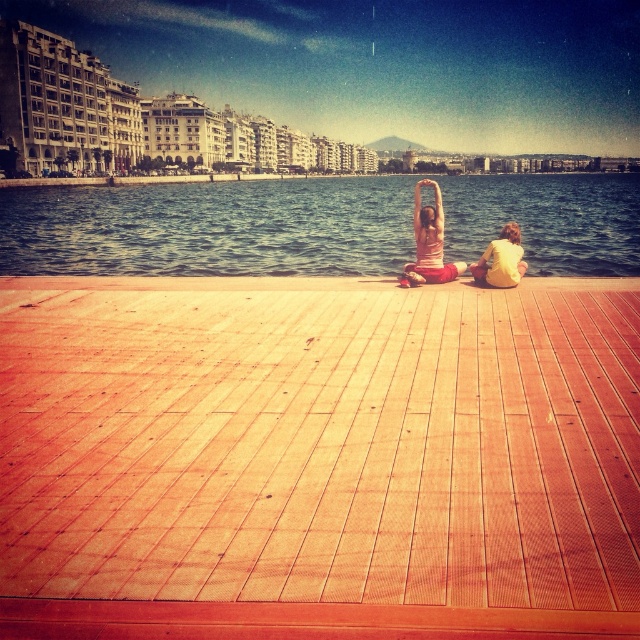
You are standing on the wooden deck and want to place a small potted plant between the wooden at center and the pink fabric at center. Based on their positions, where should you place the plant?

The wooden at center is below the pink fabric at center, so you should place the potted plant between them by positioning it above the wooden at center and below the pink fabric at center.

You are a photographer planning to capture a closeup of the pink fabric at center and yellow cotton shirt at lower right. Given their sizes, which one would require you to move closer to get a detailed shot?

The yellow cotton shirt at lower right is smaller in size than the pink fabric at center, so you would need to move closer to the yellow cotton shirt at lower right to capture its details.

From the picture: You are standing on the wooden deck and want to place a small potted plant between the wooden at center and the pink fabric at center. Which object should the plant be closer to if it needs to be placed at a lower height?

The wooden at center is shorter than the pink fabric at center, so the plant should be placed closer to the wooden at center to maintain a lower height.